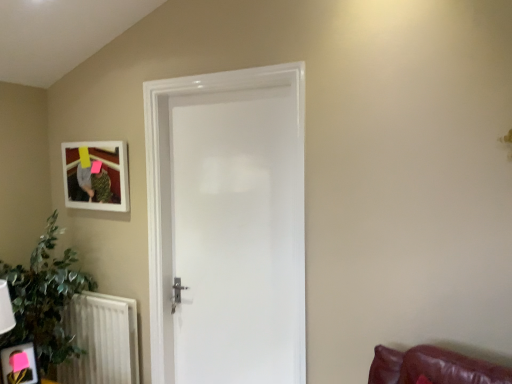
Question: From a real-world perspective, is white matte picture frame at upper left, the first picture frame from the back, located beneath matte black picture frame at lower left, which is the 2th picture frame in top-to-bottom order?

Choices:
 (A) no
 (B) yes

Answer: (A)

Question: Is white matte picture frame at upper left, the first picture frame from the back, smaller than matte black picture frame at lower left, which is counted as the first picture frame, starting from the bottom?

Choices:
 (A) no
 (B) yes

Answer: (A)

Question: Does white matte picture frame at upper left, the first picture frame from the back, appear on the left side of matte black picture frame at lower left, which is counted as the first picture frame, starting from the bottom?

Choices:
 (A) no
 (B) yes

Answer: (A)

Question: Is white matte picture frame at upper left, the first picture frame from the back, far away from matte black picture frame at lower left, which is counted as the first picture frame, starting from the bottom?

Choices:
 (A) no
 (B) yes

Answer: (A)

Question: Can you confirm if white matte picture frame at upper left, which is counted as the second picture frame, starting from the bottom, is taller than matte black picture frame at lower left, positioned as the first picture frame in front-to-back order?

Choices:
 (A) no
 (B) yes

Answer: (B)

Question: Based on their sizes in the image, would you say matte black picture frame at lower left, acting as the second picture frame starting from the back, is bigger or smaller than white glossy door at center?

Choices:
 (A) small
 (B) big

Answer: (A)

Question: Does point (34, 377) appear closer or farther from the camera than point (184, 268)?

Choices:
 (A) farther
 (B) closer

Answer: (B)

Question: Would you say matte black picture frame at lower left, which is counted as the first picture frame, starting from the bottom, is to the left or to the right of white glossy door at center in the picture?

Choices:
 (A) left
 (B) right

Answer: (A)

Question: Considering the positions of matte black picture frame at lower left, positioned as the first picture frame in front-to-back order, and white glossy door at center in the image, is matte black picture frame at lower left, positioned as the first picture frame in front-to-back order, taller or shorter than white glossy door at center?

Choices:
 (A) tall
 (B) short

Answer: (B)

Question: Is green leafy plant at lower left inside the boundaries of white matte picture frame at upper left, placed as the 2th picture frame when sorted from front to back, or outside?

Choices:
 (A) inside
 (B) outside

Answer: (B)

Question: Is green leafy plant at lower left bigger or smaller than white matte picture frame at upper left, placed as the first picture frame when sorted from top to bottom?

Choices:
 (A) small
 (B) big

Answer: (B)

Question: Does point (39, 266) appear closer or farther from the camera than point (108, 198)?

Choices:
 (A) farther
 (B) closer

Answer: (A)

Question: Considering the positions of green leafy plant at lower left and white matte picture frame at upper left, placed as the 2th picture frame when sorted from front to back, in the image, is green leafy plant at lower left wider or thinner than white matte picture frame at upper left, placed as the 2th picture frame when sorted from front to back,?

Choices:
 (A) wide
 (B) thin

Answer: (A)

Question: Is point (103, 294) positioned closer to the camera than point (15, 377)?

Choices:
 (A) closer
 (B) farther

Answer: (B)

Question: Considering the positions of white textured radiator at lower left and matte black picture frame at lower left, acting as the second picture frame starting from the back, in the image, is white textured radiator at lower left bigger or smaller than matte black picture frame at lower left, acting as the second picture frame starting from the back,?

Choices:
 (A) small
 (B) big

Answer: (B)